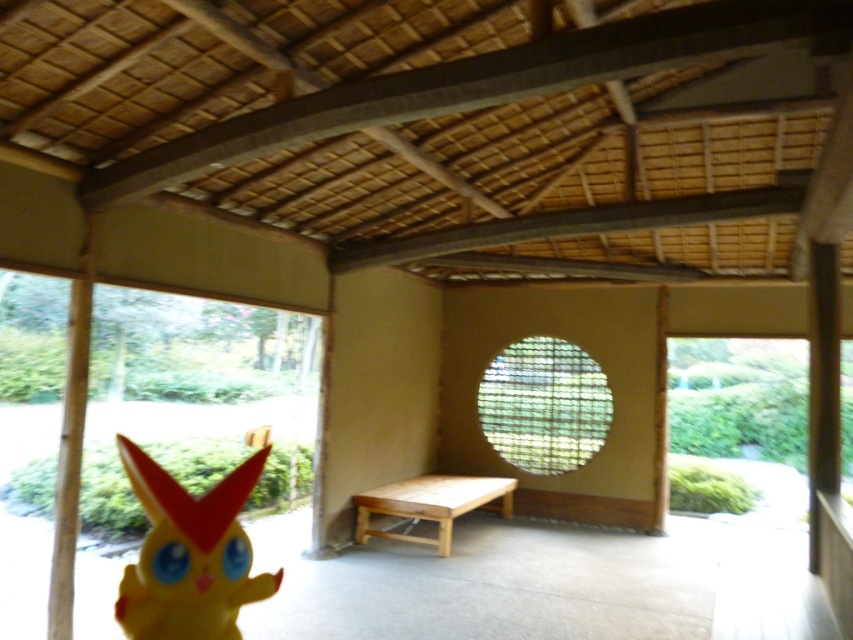
You are a visitor in this Japanese room and want to place a new small decoration. The yellow matte plush at lower left is currently there. Can you replace it with a larger one without moving the wooden bench at center?

The yellow matte plush at lower left has a smaller size compared to wooden bench at center, so replacing it with a larger decoration might be possible as long as it doesn not exceed the space the bench occupies.